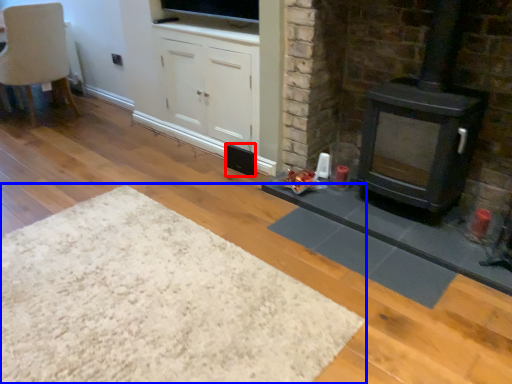
Question: Which object appears farthest to the camera in this image, speaker (highlighted by a red box) or plain (highlighted by a blue box)?

Choices:
 (A) speaker
 (B) plain

Answer: (A)